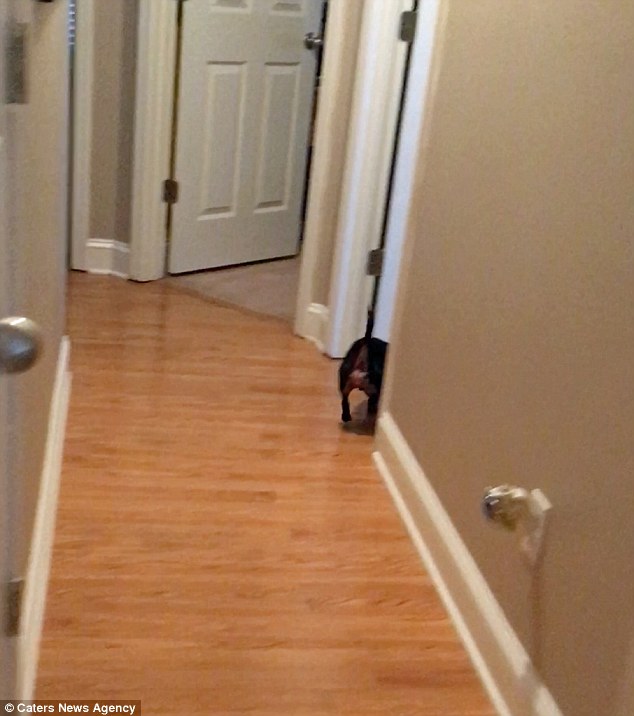
Locate an element on the screen. This screenshot has height=716, width=634. door is located at coordinates (418, 86), (257, 102).